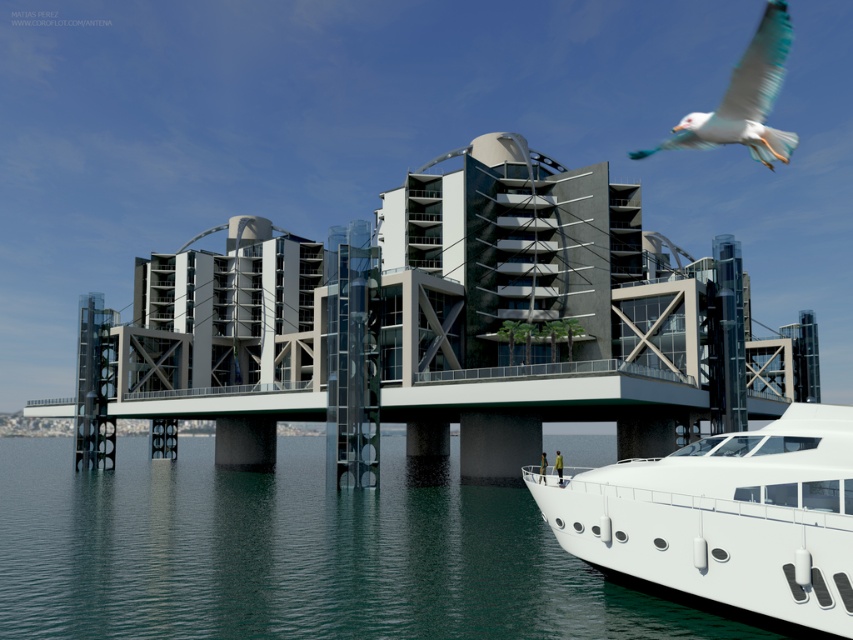
You are a drone operator trying to capture aerial footage of the futuristic building. You have two points marked on your screen for reference. Point A is at coordinates point (193, 538) and Point B is at point (775, 488). Which point is closer to your camera lens?

Point A at point (193, 538) is closer to the camera lens than point B at point (775, 488) because it is further to the camera according to the description.